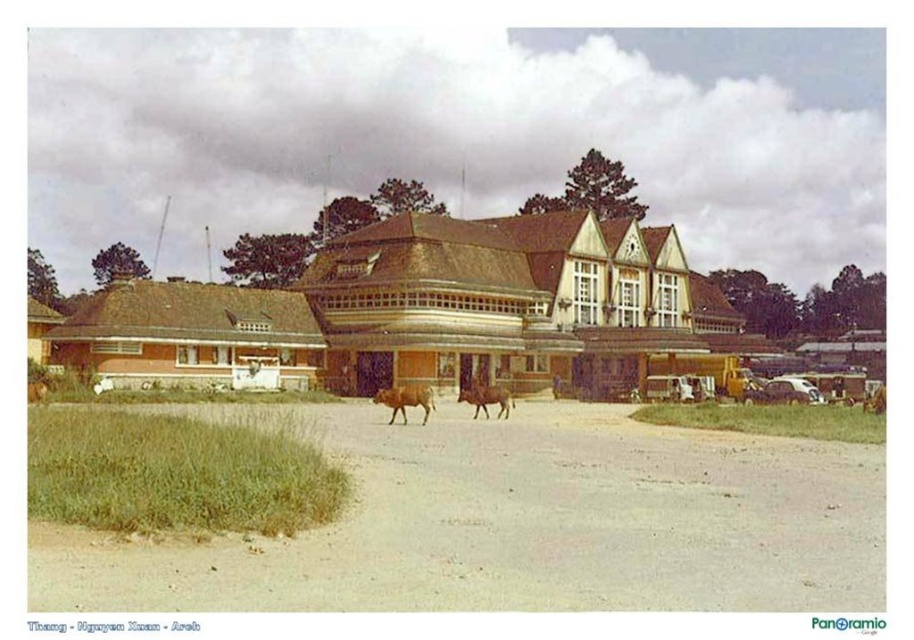
You are standing in front of a two story wooden building with a red roof. You see a brown matte bull at center and a brown leather cow at center. Which one is closer to you?

The brown matte bull at center is closer to you because it is in front of the brown leather cow at center.

Looking at this image, you are a farmer checking the space in your field. You see the brown sandy dirt field at lower center and the brown matte bull at center. Which area is wider?

The brown sandy dirt field at lower center might be wider than brown matte bull at center.